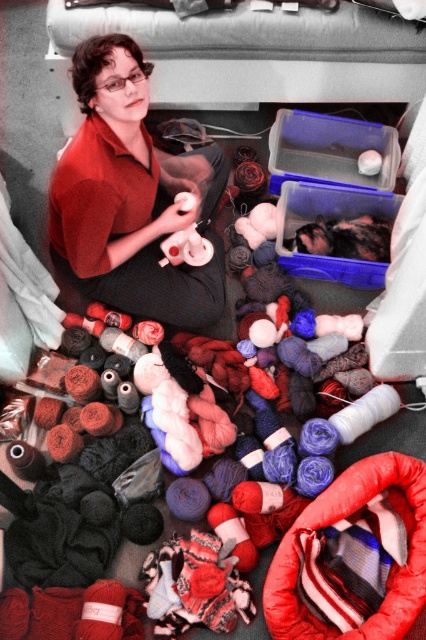
Which is above, matte red shirt at center or transparent plastic container at center?

transparent plastic container at center is higher up.

Can you confirm if matte red shirt at center is taller than transparent plastic container at center?

Indeed, matte red shirt at center has a greater height compared to transparent plastic container at center.

Is point (81, 252) more distant than point (374, 176)?

That is False.

This screenshot has width=426, height=640. I want to click on matte red shirt at center, so click(x=131, y=196).

Consider the image. Can you confirm if matte red shirt at center is positioned to the left of translucent plastic container at center?

Indeed, matte red shirt at center is positioned on the left side of translucent plastic container at center.

Which is more to the left, matte red shirt at center or translucent plastic container at center?

Positioned to the left is matte red shirt at center.

Where is `matte red shirt at center`? matte red shirt at center is located at coordinates (131, 196).

You are a GUI agent. You are given a task and a screenshot of the screen. Output one action in this format:
    pyautogui.click(x=<x>, y=<y>)
    Task: Click on the matte red shirt at center
    The width and height of the screenshot is (426, 640).
    Given the screenshot: What is the action you would take?
    pyautogui.click(x=131, y=196)

This screenshot has height=640, width=426. Find the location of `transparent plastic container at center`. transparent plastic container at center is located at coordinates (330, 150).

Between transparent plastic container at center and translucent plastic container at center, which one has less height?

Standing shorter between the two is transparent plastic container at center.

Image resolution: width=426 pixels, height=640 pixels. I want to click on transparent plastic container at center, so click(330, 150).

Where is `transparent plastic container at center`? The image size is (426, 640). transparent plastic container at center is located at coordinates (330, 150).